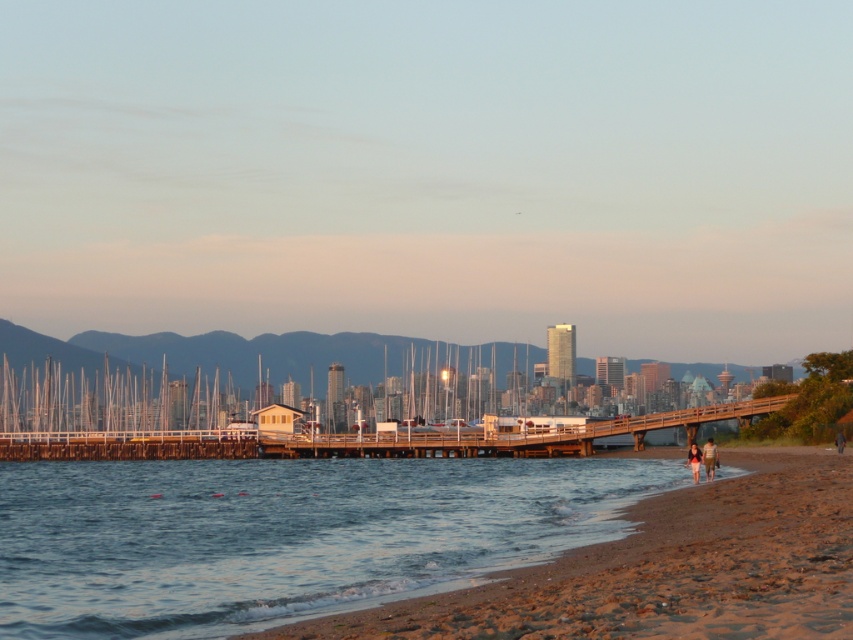
Question: Considering the real-world distances, which object is closest to the brown wooden dock at center?

Choices:
 (A) light brown sand at lower right
 (B) dark blue jeans at lower right

Answer: (A)

Question: Is clear water at lower left wider than dark blue jeans at lower right?

Choices:
 (A) no
 (B) yes

Answer: (B)

Question: Which object appears closest to the camera in this image?

Choices:
 (A) dark blue jeans at lower right
 (B) brown wooden dock at center
 (C) clear water at lower left

Answer: (C)

Question: Does clear water at lower left appear under light brown hair at lower right?

Choices:
 (A) no
 (B) yes

Answer: (B)

Question: Does brown wooden dock at center appear over light brown sand at lower right?

Choices:
 (A) yes
 (B) no

Answer: (B)

Question: Which of the following is the farthest from the observer?

Choices:
 (A) brown wooden dock at center
 (B) light brown hair at lower right
 (C) clear water at lower left

Answer: (A)